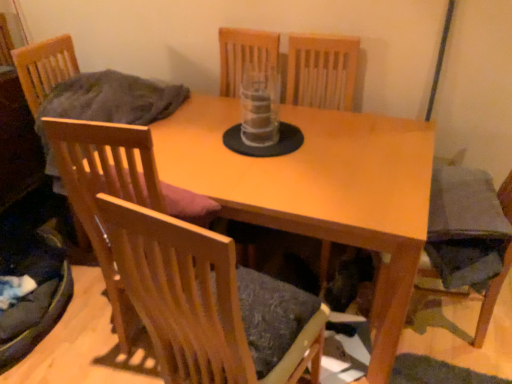
Question: Is wooden chair at center, acting as the 2th chair starting from the left, outside of velvet dark grey armchair at lower right?

Choices:
 (A) no
 (B) yes

Answer: (B)

Question: Can you confirm if wooden chair at center, the second chair in the right-to-left sequence, is wider than velvet dark grey armchair at lower right?

Choices:
 (A) no
 (B) yes

Answer: (A)

Question: Does wooden chair at center, the second chair in the right-to-left sequence, have a greater height compared to velvet dark grey armchair at lower right?

Choices:
 (A) yes
 (B) no

Answer: (A)

Question: From the image's perspective, would you say wooden chair at center, acting as the 2th chair starting from the left, is shown under velvet dark grey armchair at lower right?

Choices:
 (A) no
 (B) yes

Answer: (A)

Question: From a real-world perspective, is wooden chair at center, acting as the 2th chair starting from the left, physically below velvet dark grey armchair at lower right?

Choices:
 (A) no
 (B) yes

Answer: (A)

Question: Considering the positions of wooden chair at left, which ranks as the 1th chair in left-to-right order, and wooden chair at center, acting as the 2th chair starting from the left, in the image, is wooden chair at left, which ranks as the 1th chair in left-to-right order, taller or shorter than wooden chair at center, acting as the 2th chair starting from the left,?

Choices:
 (A) tall
 (B) short

Answer: (A)

Question: From the image's perspective, is wooden chair at left, the 3th chair when ordered from right to left, located above or below wooden chair at center, acting as the 2th chair starting from the left?

Choices:
 (A) below
 (B) above

Answer: (B)

Question: From a real-world perspective, is wooden chair at left, which ranks as the 1th chair in left-to-right order, physically located above or below wooden chair at center, acting as the 2th chair starting from the left?

Choices:
 (A) below
 (B) above

Answer: (A)

Question: Is wooden chair at left, which ranks as the 1th chair in left-to-right order, bigger or smaller than wooden chair at center, acting as the 2th chair starting from the left?

Choices:
 (A) big
 (B) small

Answer: (A)

Question: Considering the relative positions of transparent plastic vase at center and wooden chair at center, which is the 1th chair in right-to-left order, in the image provided, is transparent plastic vase at center to the left or to the right of wooden chair at center, which is the 1th chair in right-to-left order,?

Choices:
 (A) right
 (B) left

Answer: (A)

Question: From a real-world perspective, is transparent plastic vase at center above or below wooden chair at center, which is the 1th chair in right-to-left order?

Choices:
 (A) below
 (B) above

Answer: (B)

Question: Is transparent plastic vase at center taller or shorter than wooden chair at center, acting as the third chair starting from the left?

Choices:
 (A) short
 (B) tall

Answer: (A)

Question: From the image's perspective, is transparent plastic vase at center positioned above or below wooden chair at center, which is the 1th chair in right-to-left order?

Choices:
 (A) below
 (B) above

Answer: (B)

Question: From a real-world perspective, is wooden chair at center, which is the 1th chair in right-to-left order, positioned above or below light wood table at center?

Choices:
 (A) above
 (B) below

Answer: (A)

Question: Is wooden chair at center, acting as the third chair starting from the left, in front of or behind light wood table at center in the image?

Choices:
 (A) behind
 (B) front

Answer: (B)